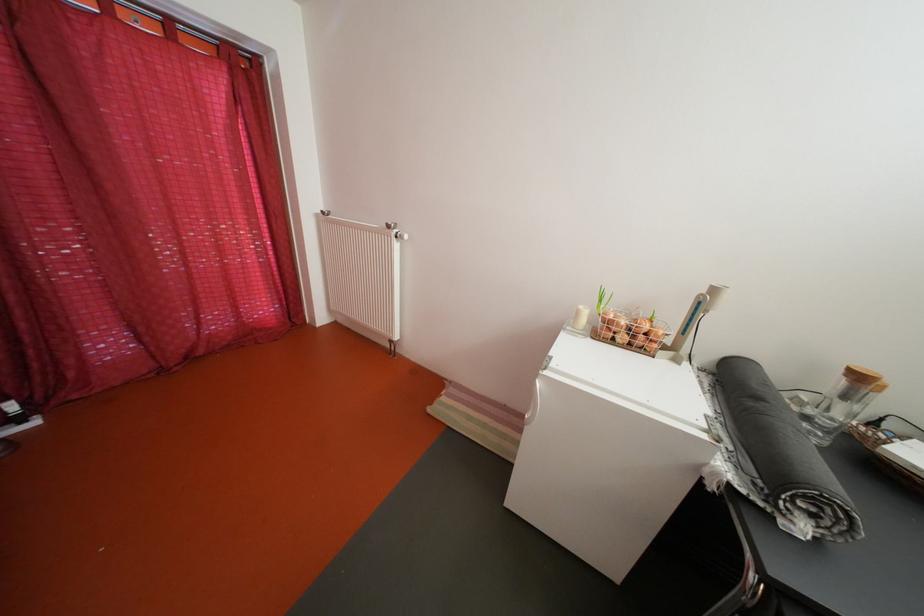
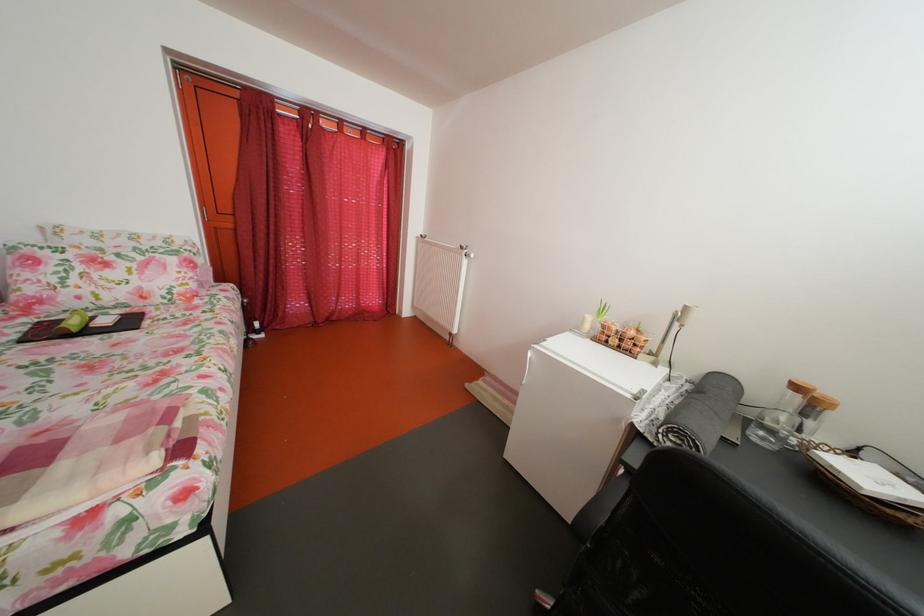
Where in the second image is the point corresponding to pixel 399 233 from the first image?

(473, 254)